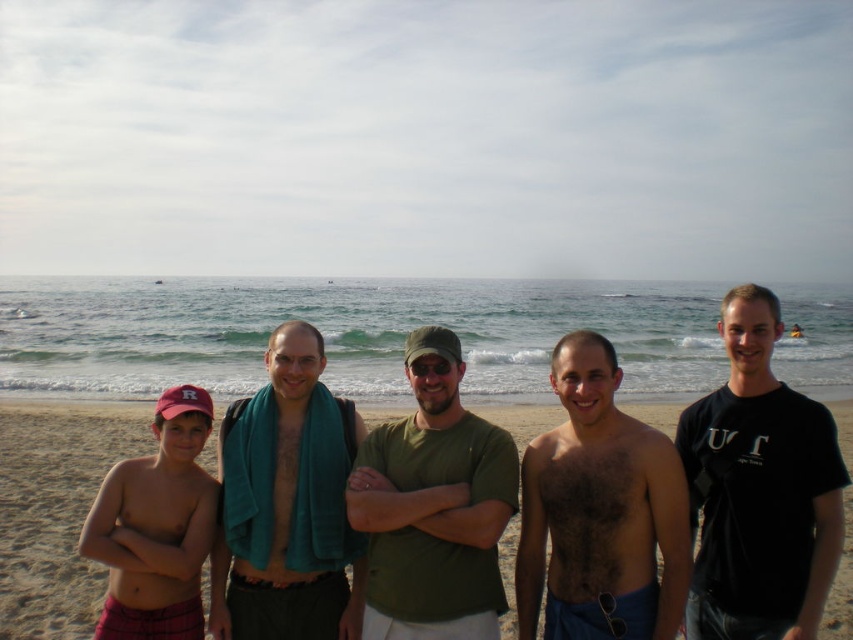
You are a photographer trying to capture a group photo of the five people on the beach. You notice the teal towel at center and the hairy skin at center might block the view. Which object is taller and could potentially block the view more?

The teal towel at center is much taller than the hairy skin at center, so it would block the view more.

You are a photographer trying to capture a photo of the beach scene. You notice two points marked in the image at coordinates point (723, 634) and point (445, 480). Which point is closer to your camera lens?

Point (723, 634) is closer to the camera lens than point (445, 480).